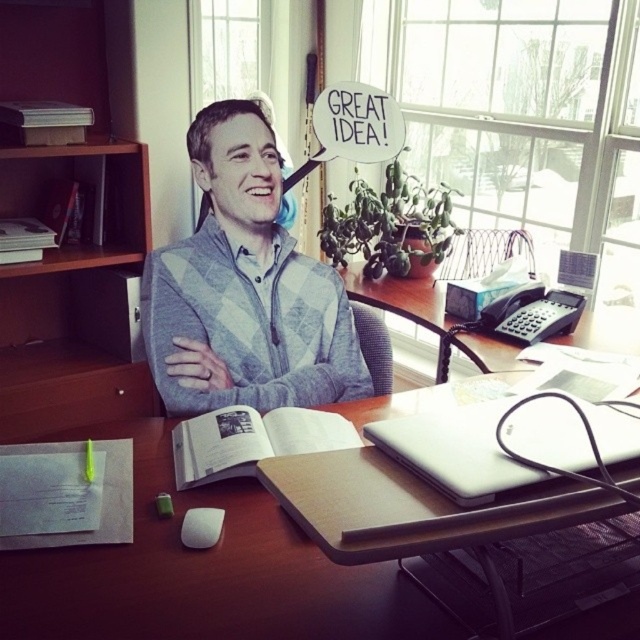
Question: Is wooden desk at center to the left of gray checkered sweater at center from the viewer's perspective?

Choices:
 (A) yes
 (B) no

Answer: (B)

Question: Is gray checkered sweater at center further to the viewer compared to white matte laptop at center?

Choices:
 (A) yes
 (B) no

Answer: (A)

Question: Based on their relative distances, which object is nearer to the gray checkered sweater at center?

Choices:
 (A) wooden desk at center
 (B) white matte laptop at center
 (C) white paper book at center

Answer: (C)

Question: Considering the real-world distances, which object is closest to the white matte laptop at center?

Choices:
 (A) wooden desk at center
 (B) gray checkered sweater at center

Answer: (A)

Question: Does white matte laptop at center appear on the left side of white paper book at center?

Choices:
 (A) no
 (B) yes

Answer: (A)

Question: Which point appears farthest from the camera in this image?

Choices:
 (A) (147, 337)
 (B) (248, 573)

Answer: (A)